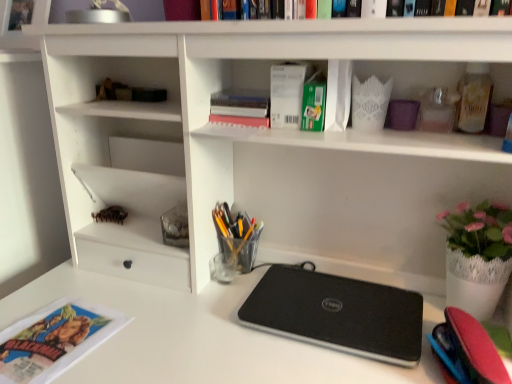
Question: Would you say black matte laptop at center is a long distance from pink matte book at upper center?

Choices:
 (A) yes
 (B) no

Answer: (B)

Question: Is black matte laptop at center located outside pink matte book at upper center?

Choices:
 (A) no
 (B) yes

Answer: (B)

Question: Considering the relative sizes of black matte laptop at center and pink matte book at upper center in the image provided, is black matte laptop at center smaller than pink matte book at upper center?

Choices:
 (A) yes
 (B) no

Answer: (B)

Question: Considering the relative sizes of black matte laptop at center and pink matte book at upper center in the image provided, is black matte laptop at center wider than pink matte book at upper center?

Choices:
 (A) yes
 (B) no

Answer: (A)

Question: Can you confirm if black matte laptop at center is positioned to the left of pink matte book at upper center?

Choices:
 (A) yes
 (B) no

Answer: (B)

Question: In terms of size, does green matte paperback book at upper center, which is the 2th paperback book from left to right, appear bigger or smaller than translucent plastic cup at center?

Choices:
 (A) small
 (B) big

Answer: (A)

Question: Considering the positions of green matte paperback book at upper center, which is the 2th paperback book from left to right, and translucent plastic cup at center in the image, is green matte paperback book at upper center, which is the 2th paperback book from left to right, wider or thinner than translucent plastic cup at center?

Choices:
 (A) wide
 (B) thin

Answer: (A)

Question: From the image's perspective, relative to translucent plastic cup at center, is green matte paperback book at upper center, positioned as the first paperback book in right-to-left order, above or below?

Choices:
 (A) below
 (B) above

Answer: (B)

Question: Does point (301, 125) appear closer or farther from the camera than point (236, 221)?

Choices:
 (A) farther
 (B) closer

Answer: (B)

Question: In the image, is translucent plastic cup at center positioned in front of or behind matte paper magazine at lower left?

Choices:
 (A) front
 (B) behind

Answer: (B)

Question: Based on their sizes in the image, would you say translucent plastic cup at center is bigger or smaller than matte paper magazine at lower left?

Choices:
 (A) big
 (B) small

Answer: (A)

Question: From the image's perspective, is translucent plastic cup at center positioned above or below matte paper magazine at lower left?

Choices:
 (A) above
 (B) below

Answer: (A)

Question: From a real-world perspective, is translucent plastic cup at center physically located above or below matte paper magazine at lower left?

Choices:
 (A) below
 (B) above

Answer: (B)

Question: From the image's perspective, is white matte paper at upper center, which appears as the 1th paperback book when viewed from the left, above or below translucent plastic cup at center?

Choices:
 (A) below
 (B) above

Answer: (B)

Question: In the image, is white matte paper at upper center, which appears as the 1th paperback book when viewed from the left, on the left side or the right side of translucent plastic cup at center?

Choices:
 (A) right
 (B) left

Answer: (A)